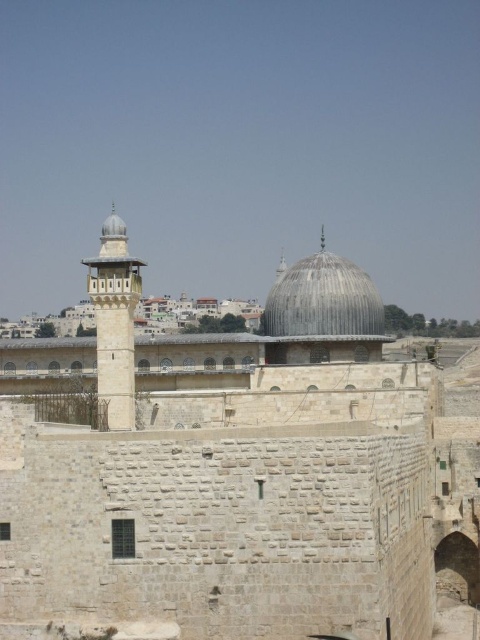
Question: Is stone dome at center to the left of gray stone dome at center from the viewer's perspective?

Choices:
 (A) yes
 (B) no

Answer: (A)

Question: Among these objects, which one is farthest from the camera?

Choices:
 (A) gray stone dome at center
 (B) stone dome at center

Answer: (A)

Question: Is stone dome at center positioned behind gray stone dome at center?

Choices:
 (A) yes
 (B) no

Answer: (B)

Question: Does stone dome at center have a larger size compared to gray stone dome at center?

Choices:
 (A) no
 (B) yes

Answer: (B)

Question: Which of the following is the closest to the observer?

Choices:
 (A) stone dome at center
 (B) gray stone dome at center

Answer: (A)